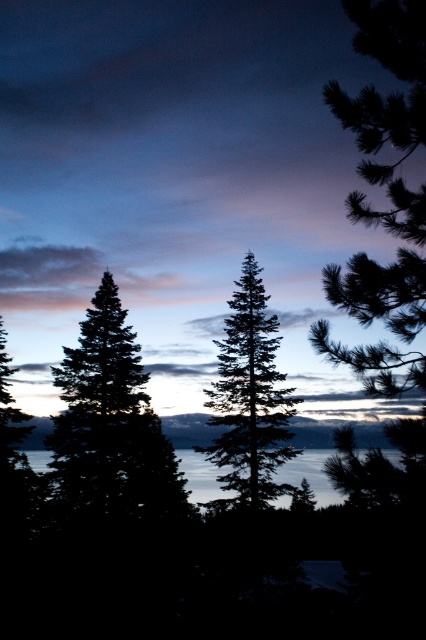
Can you confirm if silhouette pine trees at left is smaller than green matte tree at center?

No.

Who is higher up, silhouette pine trees at left or green matte tree at center?

silhouette pine trees at left is above.

Locate an element on the screen. This screenshot has width=426, height=640. silhouette pine trees at left is located at coordinates (175, 179).

Identify the location of silhouette pine trees at left. Image resolution: width=426 pixels, height=640 pixels. (175, 179).

Does silhouette pine trees at left have a lesser height compared to silhouette pine tree at center?

No.

Is silhouette pine trees at left to the right of silhouette pine tree at center from the viewer's perspective?

No, silhouette pine trees at left is not to the right of silhouette pine tree at center.

Does point (296, 35) come farther from viewer compared to point (146, 458)?

Yes, point (296, 35) is farther from viewer.

You are a GUI agent. You are given a task and a screenshot of the screen. Output one action in this format:
    pyautogui.click(x=<x>, y=<y>)
    Task: Click on the silhouette pine trees at left
    This screenshot has height=640, width=426.
    Given the screenshot: What is the action you would take?
    pyautogui.click(x=175, y=179)

Can you confirm if silhouette pine tree at center is shorter than green matte tree at center?

No.

Is point (80, 432) farther from camera compared to point (213, 340)?

No, (80, 432) is closer to viewer.

What do you see at coordinates (111, 426) in the screenshot? I see `silhouette pine tree at center` at bounding box center [111, 426].

Locate an element on the screen. silhouette pine tree at center is located at coordinates (111, 426).